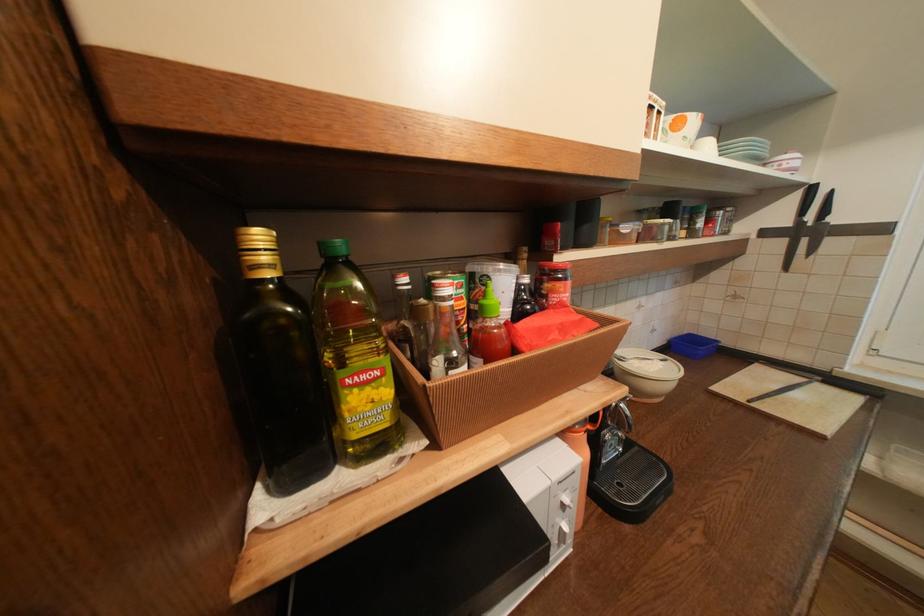
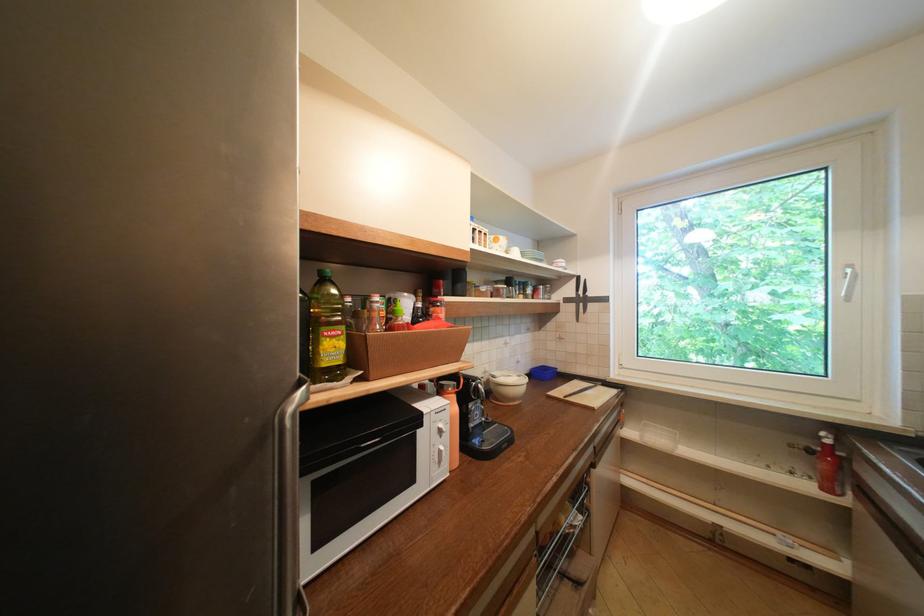
Find the pixel in the second image that matches [775,233] in the first image.

(575, 301)